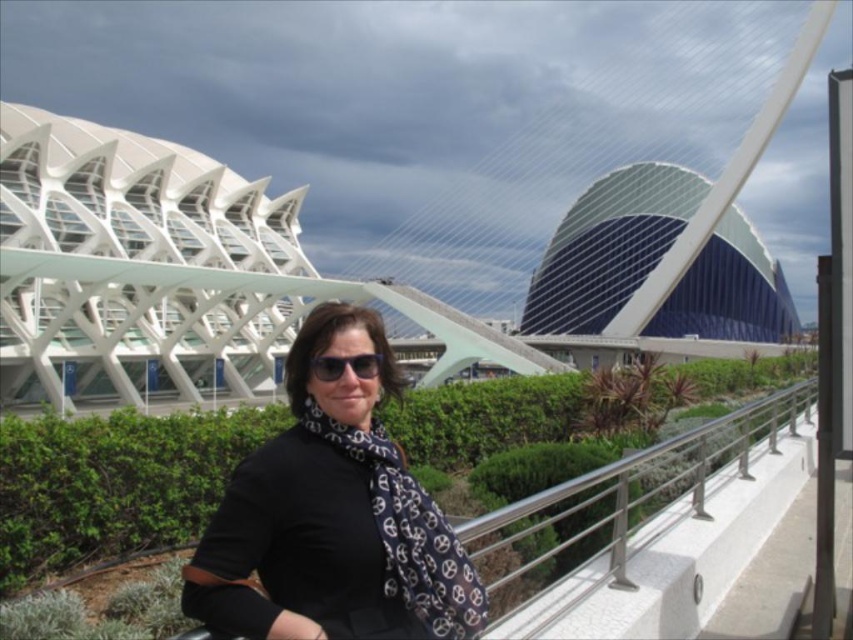
Looking at this image, is black silk scarf at center shorter than black reflective sunglasses at center?

No.

Between black silk scarf at center and black reflective sunglasses at center, which one is positioned higher?

black reflective sunglasses at center

Image resolution: width=853 pixels, height=640 pixels. Find the location of `black silk scarf at center`. black silk scarf at center is located at coordinates (332, 516).

I want to click on metallic silver railing at center, so click(619, 500).

Can you confirm if metallic silver railing at center is bigger than black reflective sunglasses at center?

Correct, metallic silver railing at center is larger in size than black reflective sunglasses at center.

Between point (519, 529) and point (322, 371), which one is positioned in front?

Point (322, 371) is in front.

Find the location of `metallic silver railing at center`. metallic silver railing at center is located at coordinates (619, 500).

Between black silk scarf at center and metallic silver railing at center, which one has less height?

metallic silver railing at center is shorter.

Is black silk scarf at center smaller than metallic silver railing at center?

Correct, black silk scarf at center occupies less space than metallic silver railing at center.

What do you see at coordinates (332, 516) in the screenshot? I see `black silk scarf at center` at bounding box center [332, 516].

This screenshot has height=640, width=853. Identify the location of black silk scarf at center. (332, 516).